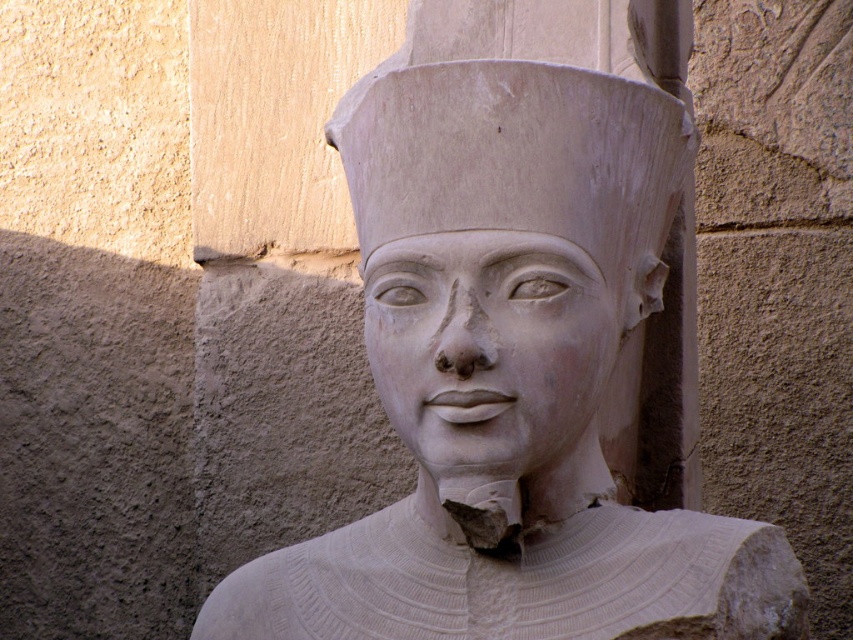
Question: Which point appears closest to the camera in this image?

Choices:
 (A) (450, 237)
 (B) (548, 401)

Answer: (A)

Question: From the image, what is the correct spatial relationship of white stone statue at center in relation to white stone head at center?

Choices:
 (A) left
 (B) right

Answer: (A)

Question: Which object appears farthest from the camera in this image?

Choices:
 (A) white stone face at center
 (B) white stone head at center

Answer: (B)

Question: Which object is farther from the camera taking this photo?

Choices:
 (A) white stone head at center
 (B) white stone statue at center

Answer: (A)

Question: Does white stone head at center appear under white stone face at center?

Choices:
 (A) no
 (B) yes

Answer: (A)

Question: Where is white stone head at center located in relation to white stone face at center in the image?

Choices:
 (A) left
 (B) right

Answer: (A)